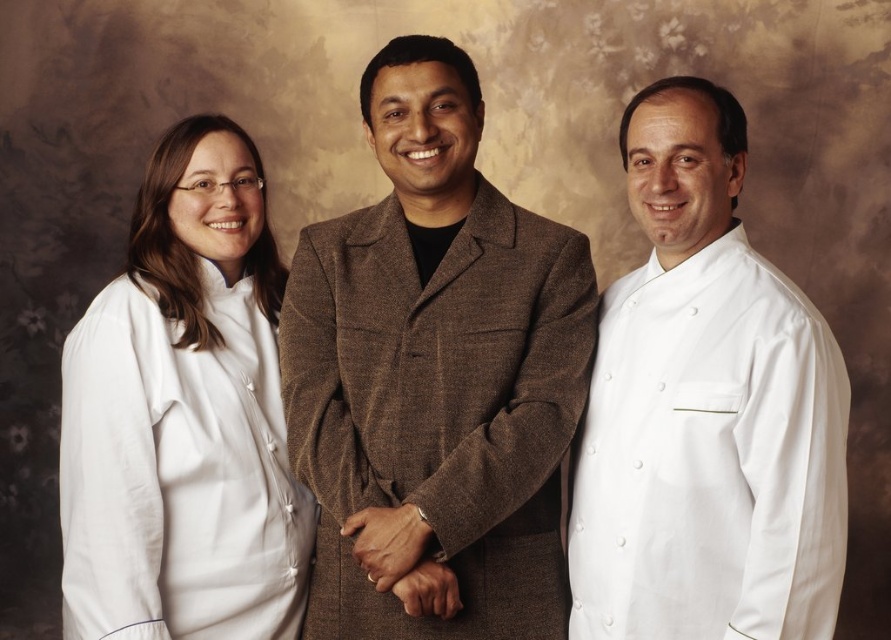
You are a photographer setting up a shoot. You need to position a light source to ensure both the brown woolen suit at center and the white fabric at left are well lit. Based on their positions, where should you place the light source relative to the subjects?

The brown woolen suit at center is above the white fabric at left. To ensure both are well lit, place the light source below the subjects so that the light can reach both the upper and lower areas effectively.

You are organizing a clothing display and need to place the white smooth chef coat at right and the white fabric at left on a rack. The rack has two slots with the left slot being narrower than the right. Which object should go into each slot to ensure they fit properly?

The white smooth chef coat at right, which is narrower, should be placed in the left slot, and the white fabric at left, which is wider, should go into the right slot to fit properly.